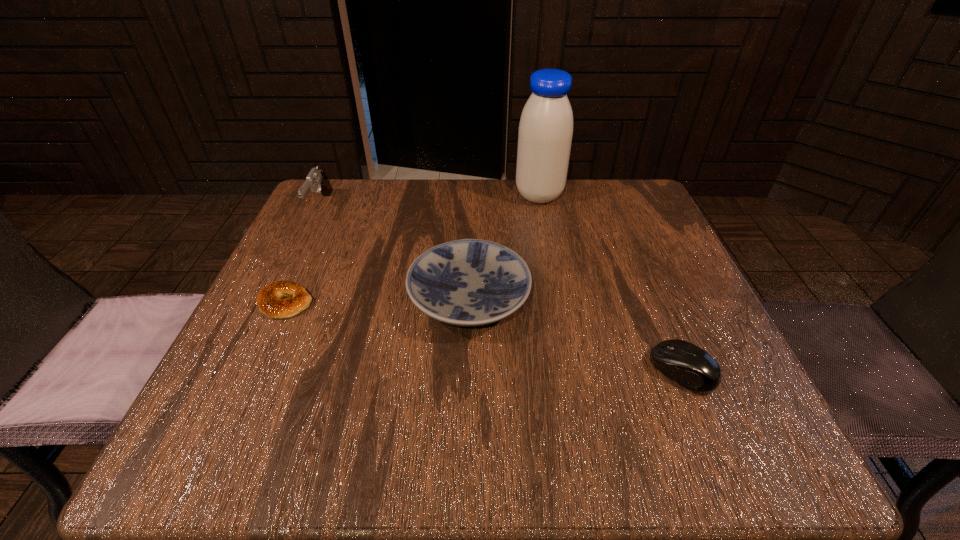
In the image, there is a desktop. Where is `vacant region at the far left corner`? vacant region at the far left corner is located at coordinates (321, 220).

The width and height of the screenshot is (960, 540). In order to click on vacant position at the far right corner of the desktop in this screenshot , I will do `click(635, 192)`.

The image size is (960, 540). I want to click on empty location between the shortest object and the third shortest object, so click(377, 301).

Locate an element on the screen. vacant area that lies between the tallest object and the bagel is located at coordinates (413, 249).

Locate an element on the screen. Image resolution: width=960 pixels, height=540 pixels. free area in between the shortest object and the second shortest object is located at coordinates (484, 337).

Locate an element on the screen. empty space between the tallest object and the fourth shortest object is located at coordinates (430, 201).

Identify the location of vacant space that's between the third shortest object and the second tallest object. (395, 253).

This screenshot has width=960, height=540. In order to click on free space between the tallest object and the bagel in this screenshot , I will do `click(413, 249)`.

Find the location of a particular element. The image size is (960, 540). vacant space that's between the second tallest object and the plate is located at coordinates (395, 253).

In order to click on the closest object relative to the third tallest object in this screenshot , I will do `click(269, 301)`.